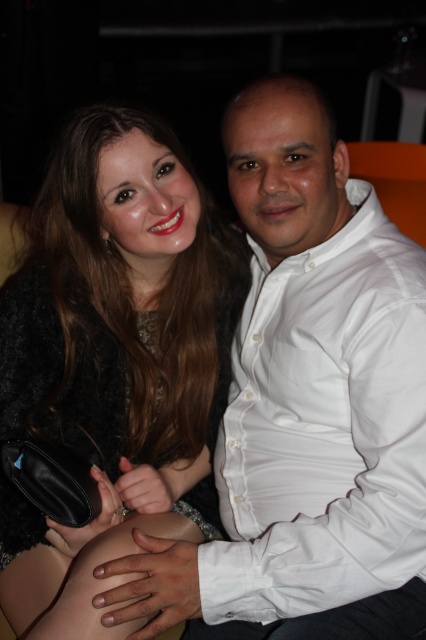
Question: Which of the following is the farthest from the observer?

Choices:
 (A) (293, 348)
 (B) (32, 428)

Answer: (B)

Question: Which point is farther to the camera?

Choices:
 (A) (319, 280)
 (B) (137, 234)

Answer: (B)

Question: Can you confirm if shiny black dress at center is smaller than white cotton shirt at right?

Choices:
 (A) no
 (B) yes

Answer: (A)

Question: In this image, where is shiny black dress at center located relative to white cotton shirt at right?

Choices:
 (A) left
 (B) right

Answer: (A)

Question: Is shiny black dress at center wider than white cotton shirt at right?

Choices:
 (A) no
 (B) yes

Answer: (B)

Question: Which object appears closest to the camera in this image?

Choices:
 (A) shiny black dress at center
 (B) white cotton shirt at right

Answer: (A)